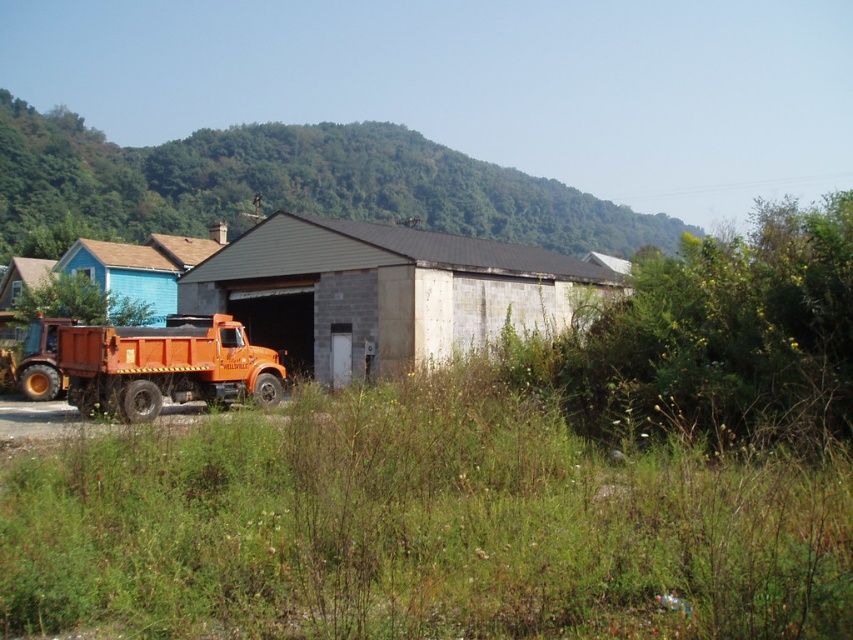
Identify the location of gray concrete barn at center. The image size is (853, 640). (381, 291).

Image resolution: width=853 pixels, height=640 pixels. I want to click on gray concrete barn at center, so [x=381, y=291].

Image resolution: width=853 pixels, height=640 pixels. What are the coordinates of `gray concrete barn at center` in the screenshot? It's located at (381, 291).

Who is more forward, (193, 154) or (274, 296)?

Positioned in front is point (274, 296).

Is point (474, 209) closer to viewer compared to point (286, 320)?

No, (474, 209) is behind (286, 320).

At what (x,y) coordinates should I click in order to perform the action: click on green leafy hillside at upper center. Please return your answer as a coordinate pair (x, y). This screenshot has width=853, height=640. Looking at the image, I should click on (283, 186).

Who is lower down, orange metallic truck at left or orange matte truck at center?

Positioned lower is orange metallic truck at left.

Can you confirm if orange metallic truck at left is positioned to the left of orange matte truck at center?

In fact, orange metallic truck at left is to the right of orange matte truck at center.

Between point (399, 499) and point (297, 372), which one is positioned behind?

The point (297, 372) is more distant.

This screenshot has height=640, width=853. I want to click on orange metallic truck at left, so click(495, 481).